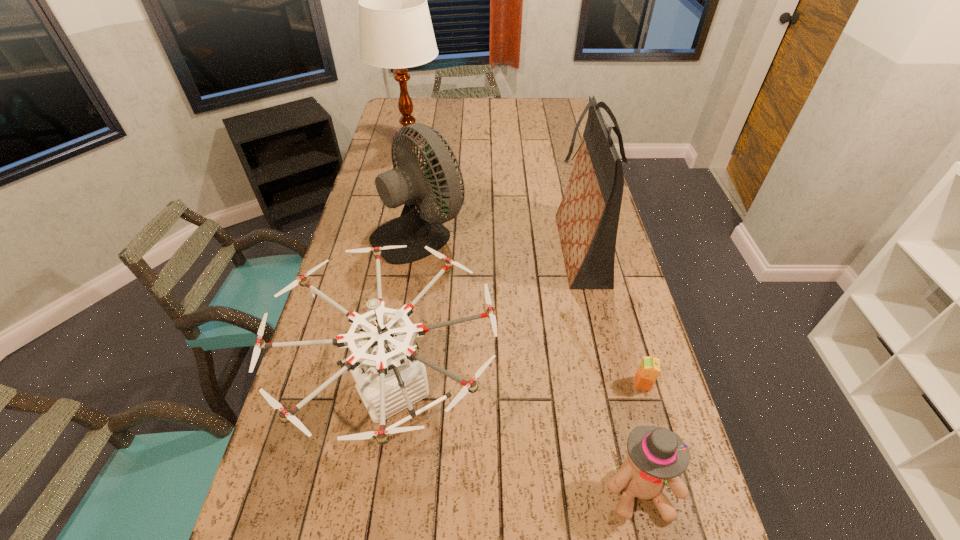
Where is `table lamp`? Image resolution: width=960 pixels, height=540 pixels. table lamp is located at coordinates (396, 32).

At what (x,y) coordinates should I click in order to perform the action: click on shopping bag. Please return your answer as a coordinate pair (x, y). Looking at the image, I should click on (587, 218).

Locate an element on the screen. The width and height of the screenshot is (960, 540). fan is located at coordinates [406, 184].

Image resolution: width=960 pixels, height=540 pixels. I want to click on drone, so click(390, 376).

Find the location of `the fifth tallest object`. the fifth tallest object is located at coordinates [x=654, y=454].

You are a GUI agent. You are given a task and a screenshot of the screen. Output one action in this format:
    pyautogui.click(x=<x>, y=<y>)
    Task: Click on the orange juice
    This screenshot has width=960, height=540.
    Given the screenshot: What is the action you would take?
    pyautogui.click(x=649, y=369)

The height and width of the screenshot is (540, 960). Find the location of `vacant space located on the right of the table lamp`. vacant space located on the right of the table lamp is located at coordinates (501, 140).

The image size is (960, 540). I want to click on vacant space situated on the front-facing side of the shopping bag, so click(448, 249).

You are a GUI agent. You are given a task and a screenshot of the screen. Output one action in this format:
    pyautogui.click(x=<x>, y=<y>)
    Task: Click on the free spot located 0.330m on the front-facing side of the shopping bag
    The width and height of the screenshot is (960, 540).
    Given the screenshot: What is the action you would take?
    pyautogui.click(x=452, y=249)

The height and width of the screenshot is (540, 960). I want to click on vacant space situated 0.280m on the front-facing side of the shopping bag, so click(467, 249).